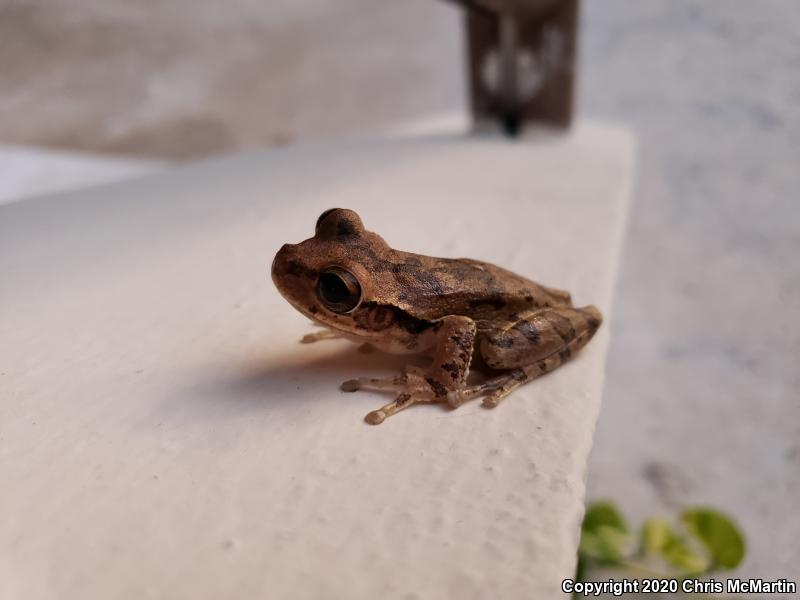
Where is `green plant`? The width and height of the screenshot is (800, 600). green plant is located at coordinates (725, 534), (610, 547).